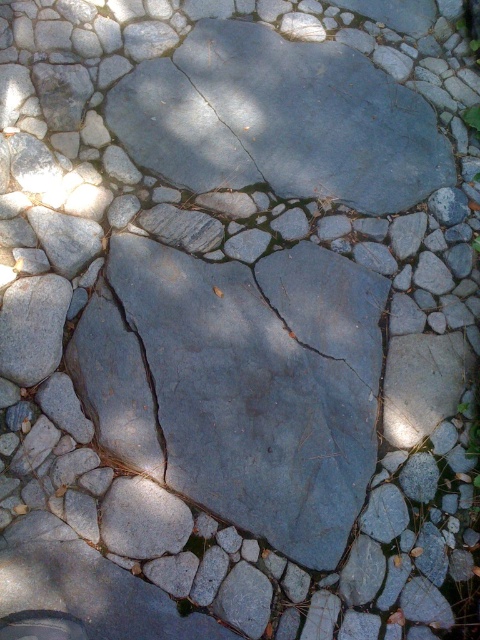
Question: Which of the following is the farthest from the observer?

Choices:
 (A) (356, 339)
 (B) (156, 406)

Answer: (A)

Question: Which point appears closest to the camera in this image?

Choices:
 (A) (144, 428)
 (B) (135, 388)

Answer: (A)

Question: Does gray rough stone at center appear over gray rough stone crack at center?

Choices:
 (A) yes
 (B) no

Answer: (B)

Question: Is gray rough stone at center further to the viewer compared to gray rough stone crack at center?

Choices:
 (A) no
 (B) yes

Answer: (A)

Question: Does gray rough stone at center appear on the left side of gray rough stone crack at center?

Choices:
 (A) no
 (B) yes

Answer: (A)